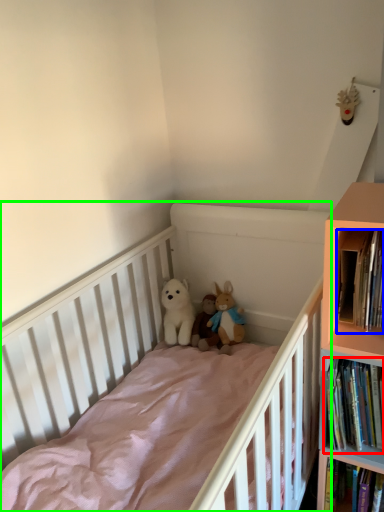
Question: Estimate the real-world distances between objects in this image. Which object is closer to book (highlighted by a red box), book (highlighted by a blue box) or infant bed (highlighted by a green box)?

Choices:
 (A) book
 (B) infant bed

Answer: (A)